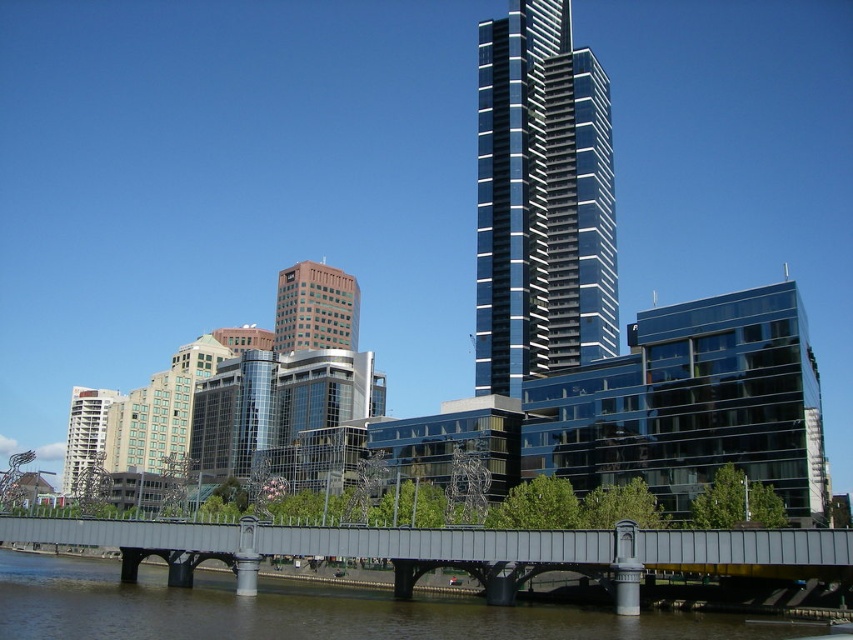
Question: Which point is closer to the camera?

Choices:
 (A) (323, 310)
 (B) (549, 157)

Answer: (B)

Question: Is glossy glass skyscraper at center to the left of orange glass building at center from the viewer's perspective?

Choices:
 (A) yes
 (B) no

Answer: (B)

Question: In this image, where is metallic gray bridge at center located relative to orange glass building at center?

Choices:
 (A) above
 (B) below

Answer: (B)

Question: Considering the real-world distances, which object is closest to the metallic gray bridge at center?

Choices:
 (A) orange glass building at center
 (B) glossy glass skyscraper at center

Answer: (B)

Question: Is metallic gray bridge at center to the right of orange glass building at center from the viewer's perspective?

Choices:
 (A) no
 (B) yes

Answer: (B)

Question: Which of the following is the farthest from the observer?

Choices:
 (A) glossy glass skyscraper at center
 (B) metallic gray bridge at center

Answer: (A)